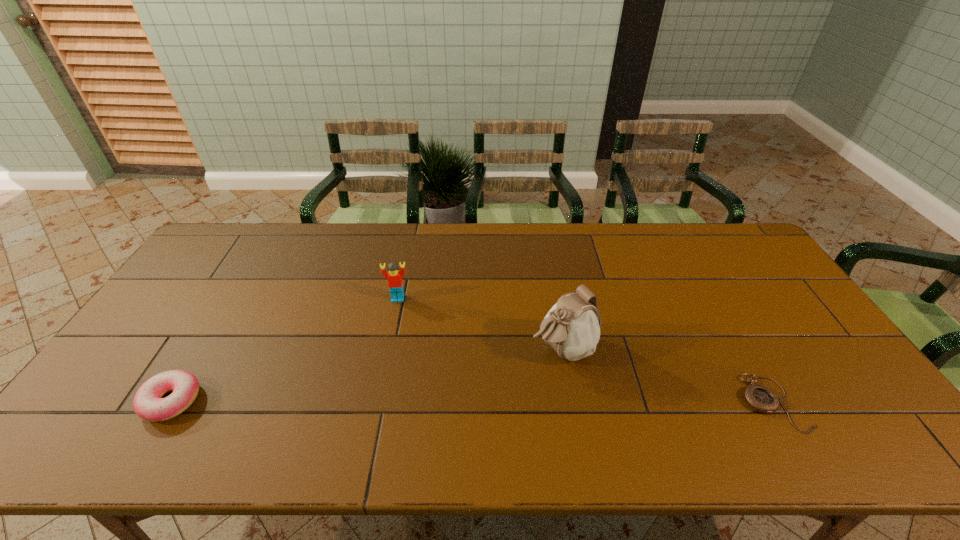
You are a GUI agent. You are given a task and a screenshot of the screen. Output one action in this format:
    pyautogui.click(x=<x>, y=<y>)
    Task: Click on the blank space at the far edge of the desktop
    This screenshot has height=540, width=960.
    Given the screenshot: What is the action you would take?
    pyautogui.click(x=561, y=237)

Locate an element on the screen. This screenshot has width=960, height=540. free point at the near edge is located at coordinates (313, 400).

Find the location of a particular element. vacant region at the left edge of the desktop is located at coordinates (201, 321).

Find the location of a particular element. The width and height of the screenshot is (960, 540). free space at the right edge is located at coordinates (781, 356).

In order to click on vacant space at the far left corner in this screenshot , I will do `click(222, 249)`.

Locate an element on the screen. Image resolution: width=960 pixels, height=540 pixels. free region at the near right corner of the desktop is located at coordinates (800, 391).

Image resolution: width=960 pixels, height=540 pixels. I want to click on vacant area between the second farthest object and the leftmost object, so click(367, 375).

The image size is (960, 540). Find the location of `unoccupied position between the third object from right to left and the second object from right to left`. unoccupied position between the third object from right to left and the second object from right to left is located at coordinates (480, 323).

Locate an element on the screen. This screenshot has height=540, width=960. empty location between the third tallest object and the tallest object is located at coordinates (367, 375).

Identify the location of free space between the rightmost object and the doughnut. The width and height of the screenshot is (960, 540). (472, 402).